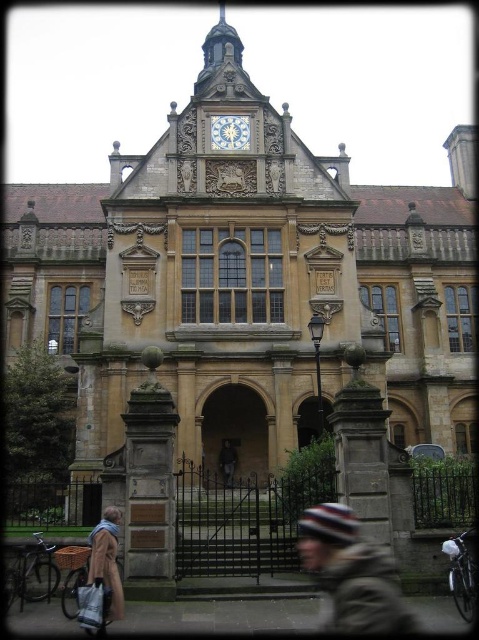
Between point (90, 634) and point (223, 454), which one is positioned in front?

Positioned in front is point (90, 634).

Which is above, tan wool coat at lower left or dark brown leather jacket at center?

dark brown leather jacket at center

Is point (120, 520) positioned in front of point (223, 445)?

Yes, it is in front of point (223, 445).

Where is `tan wool coat at lower left`? tan wool coat at lower left is located at coordinates (107, 561).

Measure the distance from brown woolen hat at center to tan wool coat at lower left.

brown woolen hat at center is 13.25 meters away from tan wool coat at lower left.

Which is more to the left, brown woolen hat at center or tan wool coat at lower left?

tan wool coat at lower left

Where is `brown woolen hat at center`? This screenshot has height=640, width=479. brown woolen hat at center is located at coordinates (352, 572).

Between brown woolen hat at center and dark brown leather jacket at center, which one has more height?

Standing taller between the two is brown woolen hat at center.

Does point (354, 538) come closer to viewer compared to point (226, 449)?

Yes, it is.

Where is `brown woolen hat at center`? This screenshot has width=479, height=640. brown woolen hat at center is located at coordinates (352, 572).